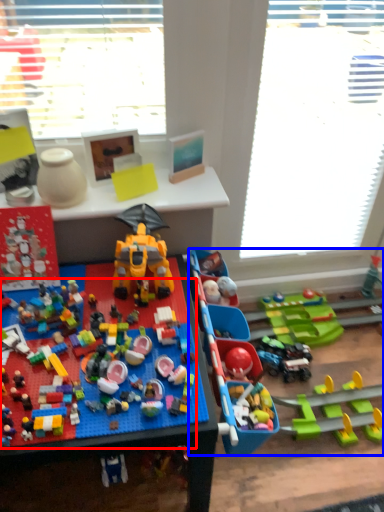
Question: Which of the following is the farthest to the observer, toy (highlighted by a red box) or toy (highlighted by a blue box)?

Choices:
 (A) toy
 (B) toy

Answer: (B)